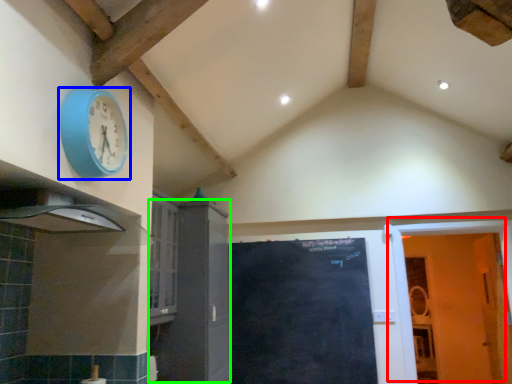
Question: Which object is the farthest from door (highlighted by a red box)? Choose among these: wall clock (highlighted by a blue box) or cabinetry (highlighted by a green box).

Choices:
 (A) wall clock
 (B) cabinetry

Answer: (A)